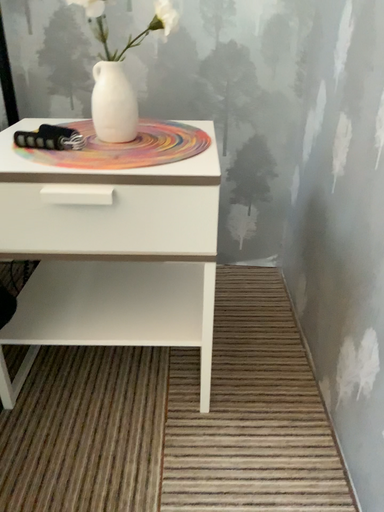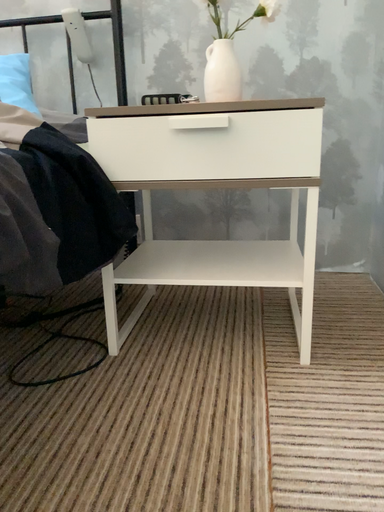
Question: Which way did the camera rotate in the video?

Choices:
 (A) rotated left
 (B) rotated right

Answer: (A)